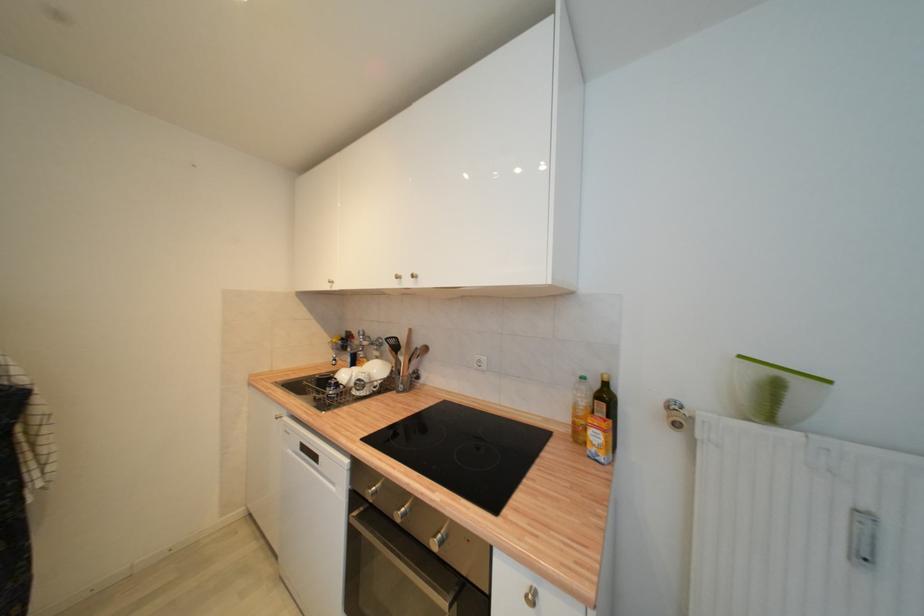
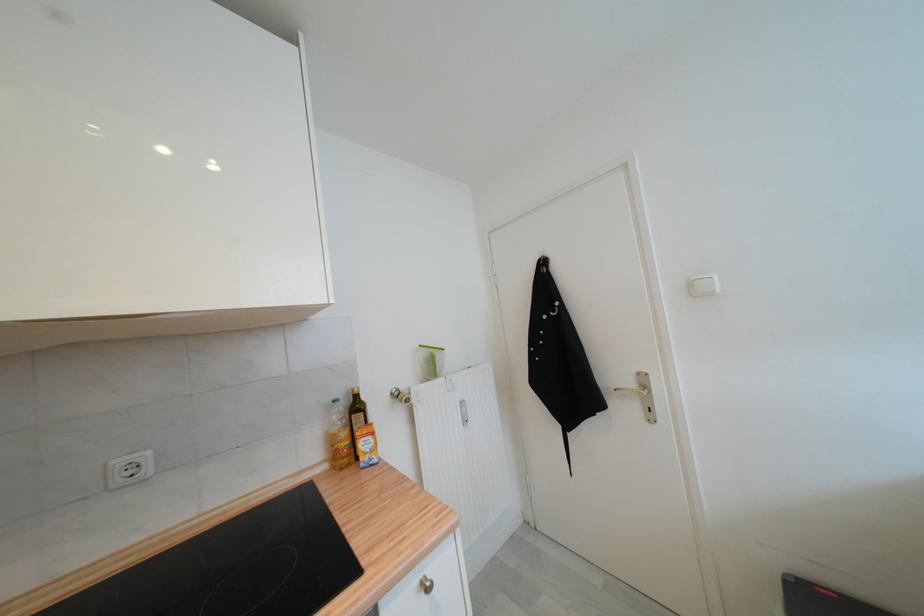
Where in the second image is the point corresponding to point (482, 359) from the first image?

(126, 464)